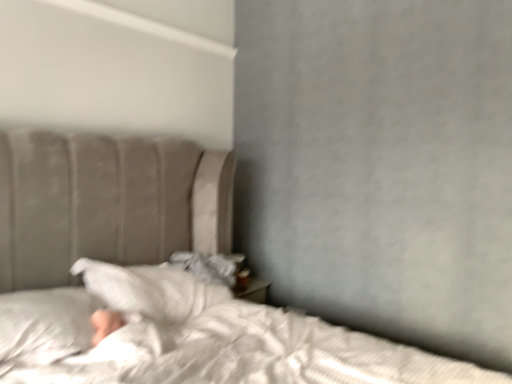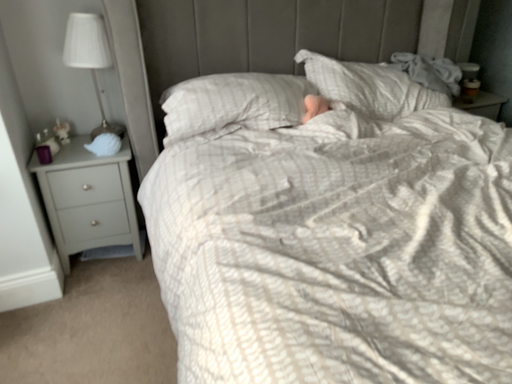
Question: How did the camera likely rotate when shooting the video?

Choices:
 (A) rotated upward
 (B) rotated downward

Answer: (B)